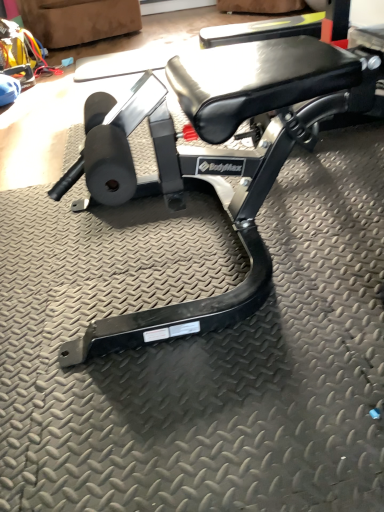
At what (x,y) coordinates should I click in order to perform the action: click on black matte bench at center. Please return your answer as a coordinate pair (x, y). Looking at the image, I should click on (213, 158).

Image resolution: width=384 pixels, height=512 pixels. What do you see at coordinates (213, 158) in the screenshot?
I see `black matte bench at center` at bounding box center [213, 158].

The image size is (384, 512). What do you see at coordinates (79, 20) in the screenshot?
I see `suede-like brown swivel chair at upper left` at bounding box center [79, 20].

Find the location of a particular element. This screenshot has height=512, width=384. suede-like brown swivel chair at upper left is located at coordinates (79, 20).

This screenshot has width=384, height=512. Identify the location of black matte bench at center. (213, 158).

Can you confirm if black matte bench at center is positioned to the left of suede-like brown swivel chair at upper left?

Incorrect, black matte bench at center is not on the left side of suede-like brown swivel chair at upper left.

Is black matte bench at center positioned behind suede-like brown swivel chair at upper left?

No, black matte bench at center is closer to the camera.

Is point (290, 53) positioned before point (88, 21)?

Yes.

From the image's perspective, is black matte bench at center above or below suede-like brown swivel chair at upper left?

Clearly, from the image's perspective, black matte bench at center is below suede-like brown swivel chair at upper left.

From the picture: From a real-world perspective, is black matte bench at center physically above suede-like brown swivel chair at upper left?

No, from a real-world perspective, black matte bench at center is not on top of suede-like brown swivel chair at upper left.

Considering the relative sizes of black matte bench at center and suede-like brown swivel chair at upper left in the image provided, is black matte bench at center thinner than suede-like brown swivel chair at upper left?

No, black matte bench at center is not thinner than suede-like brown swivel chair at upper left.

Considering the sizes of objects black matte bench at center and suede-like brown swivel chair at upper left in the image provided, who is taller, black matte bench at center or suede-like brown swivel chair at upper left?

suede-like brown swivel chair at upper left is taller.

In terms of size, does black matte bench at center appear bigger or smaller than suede-like brown swivel chair at upper left?

Considering their sizes, black matte bench at center takes up more space than suede-like brown swivel chair at upper left.

Looking at this image, is suede-like brown swivel chair at upper left surrounded by black matte bench at center?

Actually, suede-like brown swivel chair at upper left is outside black matte bench at center.

Is black matte bench at center beside suede-like brown swivel chair at upper left?

No, black matte bench at center is not with suede-like brown swivel chair at upper left.

Is black matte bench at center looking in the opposite direction of suede-like brown swivel chair at upper left?

That's not correct — black matte bench at center is not looking away from suede-like brown swivel chair at upper left.

Measure the distance from black matte bench at center to suede-like brown swivel chair at upper left.

2.24 meters.

At what (x,y) coordinates should I click in order to perform the action: click on bench on the right of the suede-like brown swivel chair at upper left. Please return your answer as a coordinate pair (x, y). This screenshot has height=512, width=384. Looking at the image, I should click on (213, 158).

Does suede-like brown swivel chair at upper left appear on the left side of black matte bench at center?

Yes.

Relative to black matte bench at center, is suede-like brown swivel chair at upper left in front or behind?

suede-like brown swivel chair at upper left is positioned farther from the viewer than black matte bench at center.

Which is farther, (105, 32) or (283, 101)?

Positioned behind is point (105, 32).

From the image's perspective, between suede-like brown swivel chair at upper left and black matte bench at center, who is located below?

black matte bench at center is shown below in the image.

From a real-world perspective, between suede-like brown swivel chair at upper left and black matte bench at center, who is vertically higher?

suede-like brown swivel chair at upper left, from a real-world perspective.

Which of these two, suede-like brown swivel chair at upper left or black matte bench at center, is thinner?

Thinner between the two is suede-like brown swivel chair at upper left.

In terms of height, does suede-like brown swivel chair at upper left look taller or shorter compared to black matte bench at center?

suede-like brown swivel chair at upper left is taller than black matte bench at center.

Between suede-like brown swivel chair at upper left and black matte bench at center, which one has smaller size?

suede-like brown swivel chair at upper left is smaller.

Is black matte bench at center a part of suede-like brown swivel chair at upper left?

Definitely not — black matte bench at center is not inside suede-like brown swivel chair at upper left.

Is the surface of suede-like brown swivel chair at upper left in direct contact with black matte bench at center?

No, suede-like brown swivel chair at upper left is not beside black matte bench at center.

Is suede-like brown swivel chair at upper left oriented away from black matte bench at center?

No, suede-like brown swivel chair at upper left is not facing the opposite direction of black matte bench at center.

Measure the distance between suede-like brown swivel chair at upper left and black matte bench at center.

suede-like brown swivel chair at upper left and black matte bench at center are 2.24 meters apart from each other.

Where is `bench below the suede-like brown swivel chair at upper left (from a real-world perspective)`? bench below the suede-like brown swivel chair at upper left (from a real-world perspective) is located at coordinates (213, 158).

There is a black matte bench at center. Where is `swivel chair above it (from a real-world perspective)`? The image size is (384, 512). swivel chair above it (from a real-world perspective) is located at coordinates (79, 20).

At what (x,y) coordinates should I click in order to perform the action: click on bench in front of the suede-like brown swivel chair at upper left. Please return your answer as a coordinate pair (x, y). The width and height of the screenshot is (384, 512). Looking at the image, I should click on (213, 158).